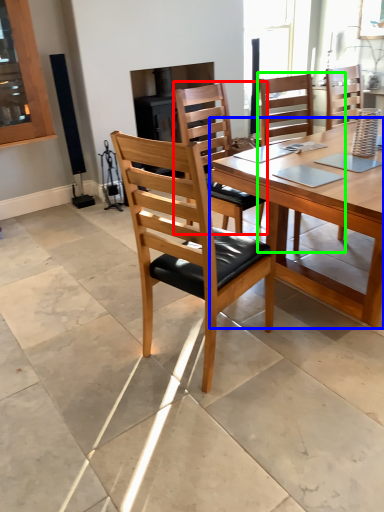
Question: Estimate the real-world distances between objects in this image. Which object is closer to chair (highlighted by a red box), kitchen & dining room table (highlighted by a blue box) or chair (highlighted by a green box)?

Choices:
 (A) kitchen & dining room table
 (B) chair

Answer: (A)